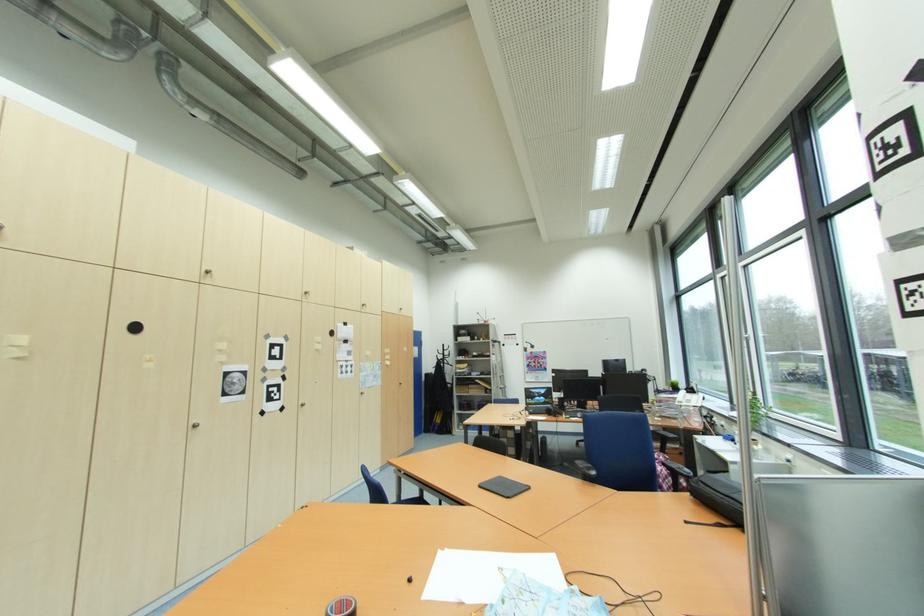
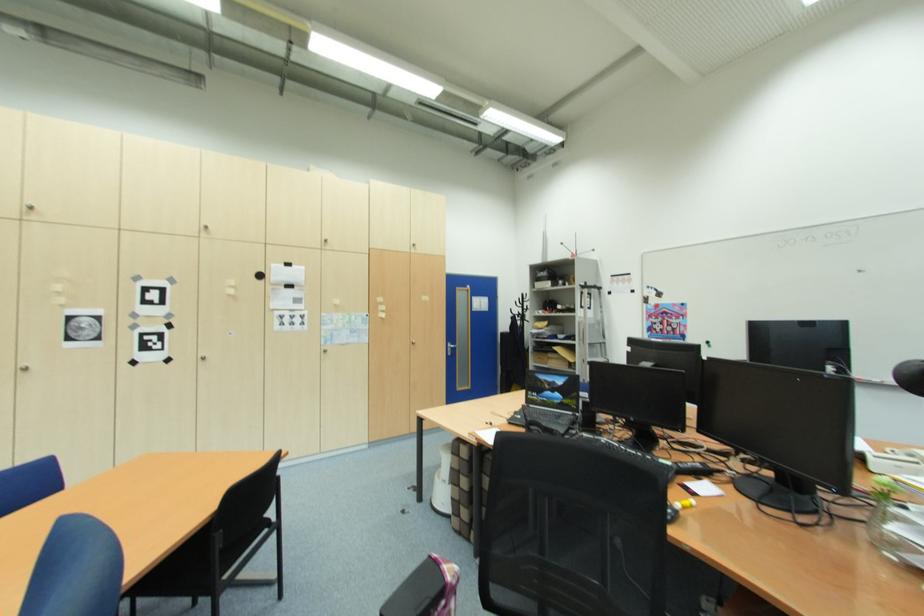
Find the pixel in the second image that matches point 405,385 in the first image.

(418, 345)